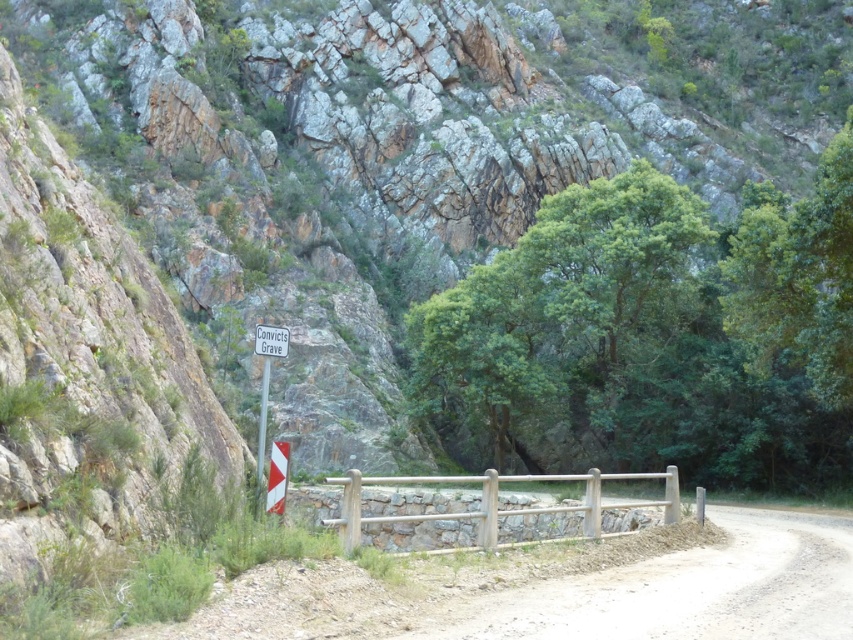
You are a hiker trying to navigate through the rugged landscape. You see a wooden fence at center and a white plastic sign at lower left. Which object is larger in size?

The wooden fence at center is bigger than the white plastic sign at lower left.